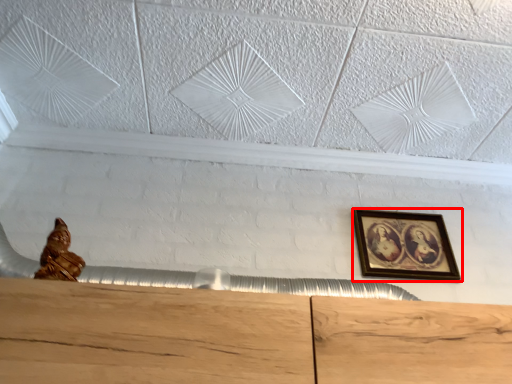
Question: In this image, where is picture frame (annotated by the red box) located relative to sculpture?

Choices:
 (A) left
 (B) right

Answer: (B)